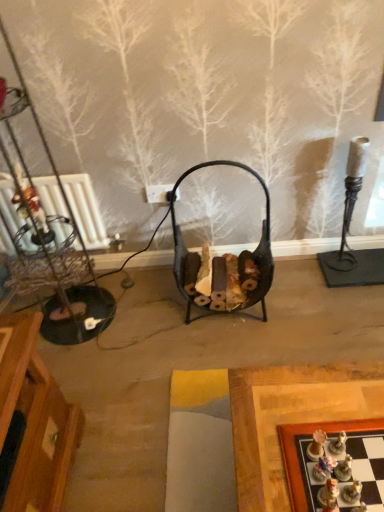
Question: Are wooden chessboard at lower right and black metal basket at center located far from each other?

Choices:
 (A) no
 (B) yes

Answer: (A)

Question: Is the position of wooden chessboard at lower right less distant than that of black metal basket at center?

Choices:
 (A) no
 (B) yes

Answer: (B)

Question: Can you confirm if wooden chessboard at lower right is wider than black metal basket at center?

Choices:
 (A) yes
 (B) no

Answer: (A)

Question: Does wooden chessboard at lower right appear on the left side of black metal basket at center?

Choices:
 (A) no
 (B) yes

Answer: (A)

Question: Considering the relative positions of wooden chessboard at lower right and black metal basket at center in the image provided, is wooden chessboard at lower right to the right of black metal basket at center from the viewer's perspective?

Choices:
 (A) no
 (B) yes

Answer: (B)

Question: Based on their sizes in the image, would you say matte plastic chess piece at lower right is bigger or smaller than wooden chessboard at lower right?

Choices:
 (A) big
 (B) small

Answer: (B)

Question: In terms of height, does matte plastic chess piece at lower right look taller or shorter compared to wooden chessboard at lower right?

Choices:
 (A) tall
 (B) short

Answer: (A)

Question: From the image's perspective, is matte plastic chess piece at lower right above or below wooden chessboard at lower right?

Choices:
 (A) above
 (B) below

Answer: (A)

Question: Considering the positions of matte plastic chess piece at lower right and wooden chessboard at lower right in the image, is matte plastic chess piece at lower right wider or thinner than wooden chessboard at lower right?

Choices:
 (A) thin
 (B) wide

Answer: (A)

Question: Based on their positions, is black metal basket at center located to the left or right of wooden chessboard at lower right?

Choices:
 (A) left
 (B) right

Answer: (A)

Question: Considering their positions, is black metal basket at center located in front of or behind wooden chessboard at lower right?

Choices:
 (A) behind
 (B) front

Answer: (A)

Question: Does point (261, 303) appear closer or farther from the camera than point (365, 429)?

Choices:
 (A) farther
 (B) closer

Answer: (A)

Question: From a real-world perspective, is black metal basket at center positioned above or below wooden chessboard at lower right?

Choices:
 (A) above
 (B) below

Answer: (B)

Question: In terms of size, does wooden chessboard at lower right appear bigger or smaller than black metal basket at center?

Choices:
 (A) small
 (B) big

Answer: (A)

Question: Considering the positions of wooden chessboard at lower right and black metal basket at center in the image, is wooden chessboard at lower right taller or shorter than black metal basket at center?

Choices:
 (A) short
 (B) tall

Answer: (A)